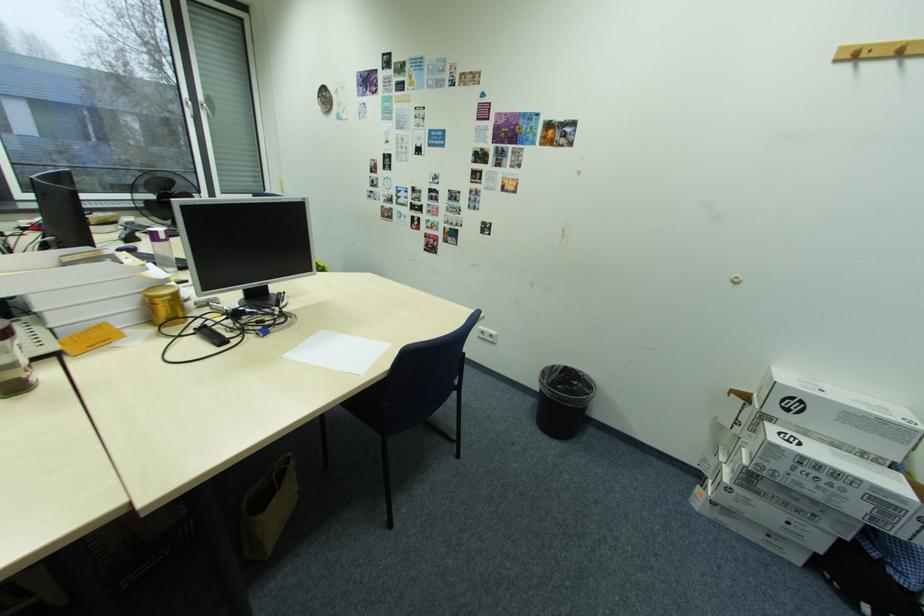
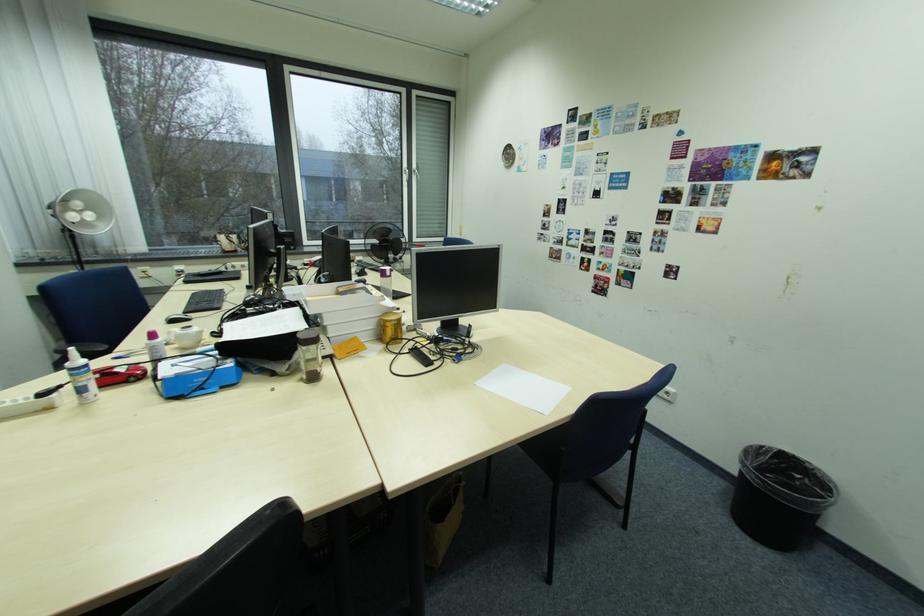
In a continuous first-person perspective shot, in which direction is the camera moving?

The cameraman moved toward left, backward.